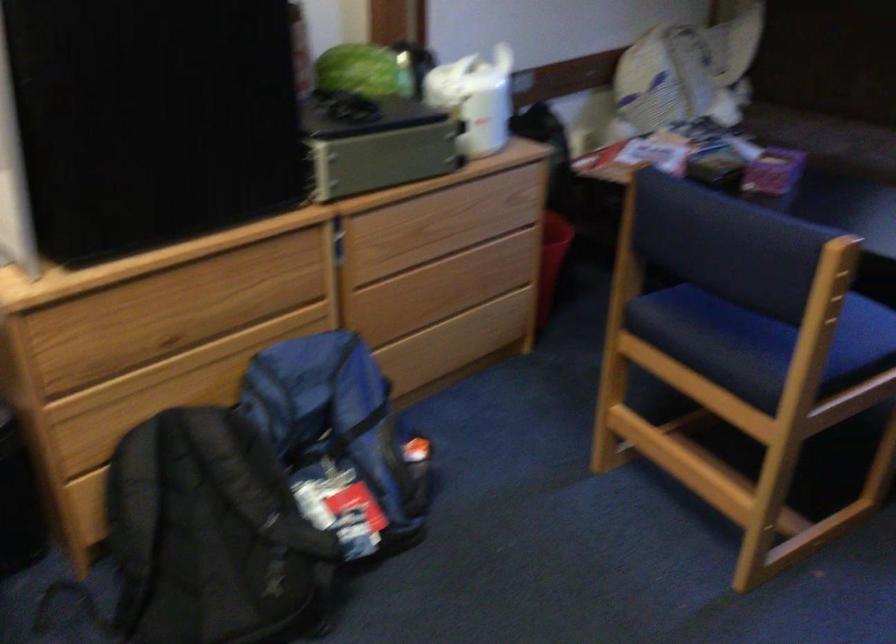
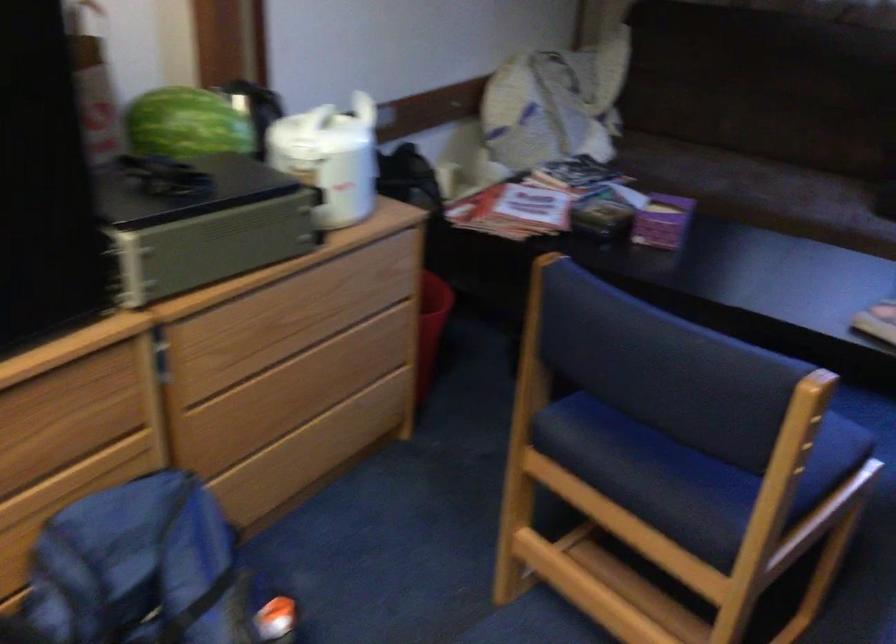
Question: In a continuous first-person perspective shot, in which direction is the camera moving?

Choices:
 (A) Left
 (B) Right
 (C) Forward
 (D) Backward

Answer: (C)